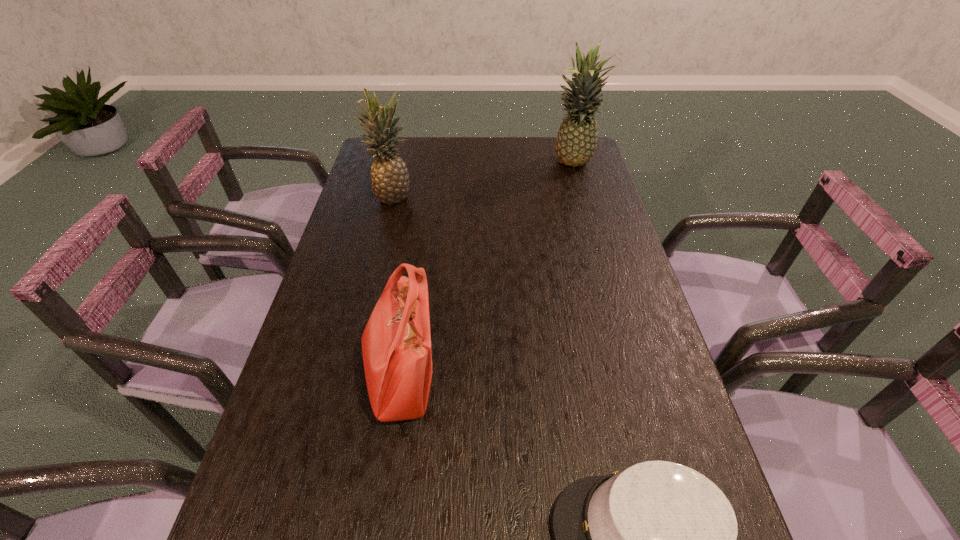
Locate an element on the screen. This screenshot has width=960, height=540. handbag positioned at the left edge is located at coordinates (396, 343).

Identify the location of object that is at the right edge. (576, 142).

Where is `object located in the far right corner section of the desktop`? Image resolution: width=960 pixels, height=540 pixels. object located in the far right corner section of the desktop is located at coordinates (576, 142).

I want to click on vacant space at the far edge of the desktop, so click(541, 160).

You are a GUI agent. You are given a task and a screenshot of the screen. Output one action in this format:
    pyautogui.click(x=<x>, y=<y>)
    Task: Click on the vacant space at the left edge
    Image resolution: width=960 pixels, height=540 pixels.
    Given the screenshot: What is the action you would take?
    pyautogui.click(x=363, y=194)

Identify the location of free space at the right edge. (619, 224).

Locate an element on the screen. The image size is (960, 540). blank region between the tallest object and the nearer pineapple is located at coordinates (482, 180).

Locate an element on the screen. This screenshot has width=960, height=540. free space between the nearer pineapple and the farther pineapple is located at coordinates (482, 180).

Locate an element on the screen. This screenshot has height=540, width=960. free space that is in between the right pineapple and the third farthest object is located at coordinates pyautogui.click(x=486, y=271).

What are the coordinates of `vacant point located between the nearer pineapple and the tallest object` in the screenshot? It's located at (482, 180).